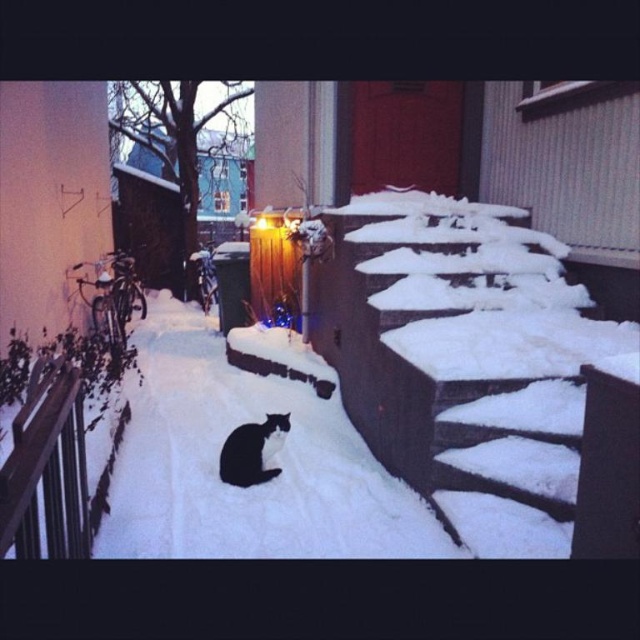
Who is positioned more to the left, snow-covered wooden stairs at center or wooden rail at lower left?

From the viewer's perspective, wooden rail at lower left appears more on the left side.

Does snow-covered wooden stairs at center appear on the right side of wooden rail at lower left?

Yes, snow-covered wooden stairs at center is to the right of wooden rail at lower left.

This screenshot has height=640, width=640. Describe the element at coordinates (464, 360) in the screenshot. I see `snow-covered wooden stairs at center` at that location.

Locate an element on the screen. This screenshot has width=640, height=640. snow-covered wooden stairs at center is located at coordinates (464, 360).

Locate an element on the screen. This screenshot has height=640, width=640. wooden rail at lower left is located at coordinates (45, 468).

Consider the image. Which is more to the right, wooden rail at lower left or black fur cat at center?

From the viewer's perspective, black fur cat at center appears more on the right side.

Who is more forward, (29, 545) or (241, 467)?

Point (29, 545) is in front.

Locate an element on the screen. This screenshot has width=640, height=640. wooden rail at lower left is located at coordinates (45, 468).

Is white fluffy snow at center bigger than wooden rail at lower left?

Actually, white fluffy snow at center might be smaller than wooden rail at lower left.

Identify the location of white fluffy snow at center. (253, 486).